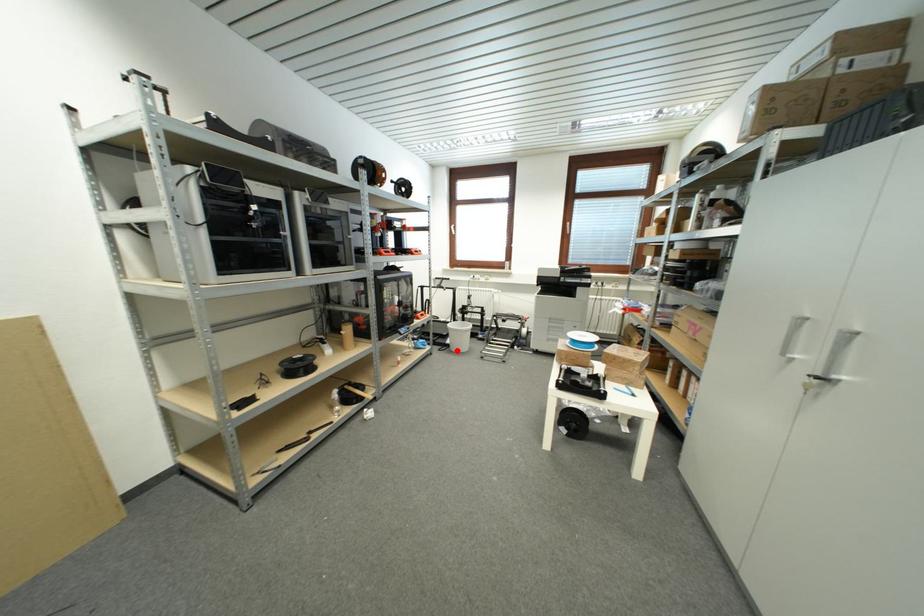
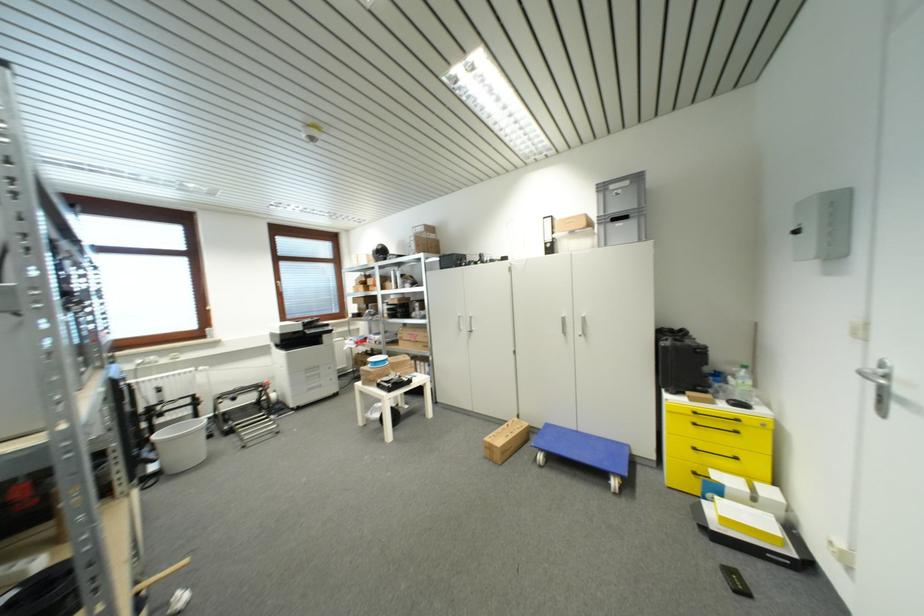
Question: I am providing you with two images of the same scene from different viewpoints. Given a red point in image1, look at the same physical point in image2. Is it:

Choices:
 (A) Closer to the viewpoint
 (B) Farther from the viewpoint

Answer: (A)